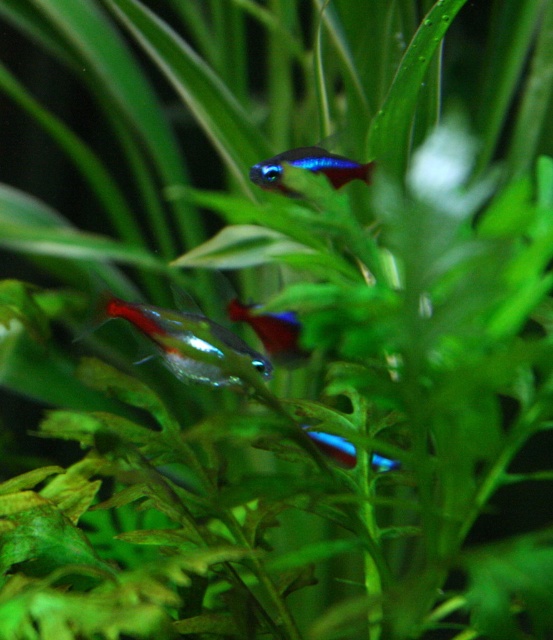
Question: Does shiny blue and red fish at center have a lesser width compared to blue glossy neon fish at center?

Choices:
 (A) yes
 (B) no

Answer: (B)

Question: Among these objects, which one is nearest to the camera?

Choices:
 (A) shiny blue and red fish at center
 (B) blue glossy neon fish at center
 (C) translucent glass fish at center
 (D) shiny blue glass fish at center

Answer: (C)

Question: Which point is closer to the camera?

Choices:
 (A) shiny blue glass fish at center
 (B) translucent glass fish at center
 (C) blue glossy neon fish at center
 (D) shiny blue and red fish at center

Answer: (B)

Question: Is shiny blue glass fish at center wider than blue glossy neon fish at center?

Choices:
 (A) no
 (B) yes

Answer: (B)

Question: Can you confirm if shiny blue and red fish at center is smaller than blue glossy neon fish at center?

Choices:
 (A) yes
 (B) no

Answer: (B)

Question: Among these objects, which one is nearest to the camera?

Choices:
 (A) shiny blue and red fish at center
 (B) blue glossy neon fish at center
 (C) translucent glass fish at center

Answer: (C)